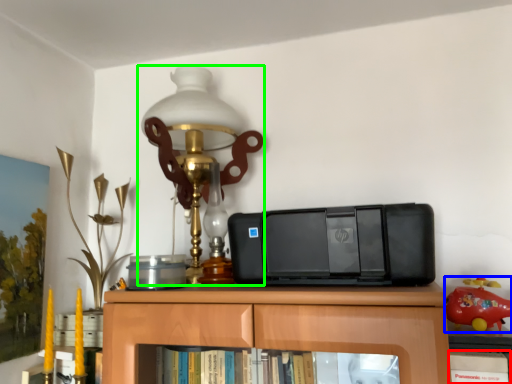
Question: Which is nearer to the book (highlighted by a red box)? toy (highlighted by a blue box) or lamp (highlighted by a green box).

Choices:
 (A) toy
 (B) lamp

Answer: (A)